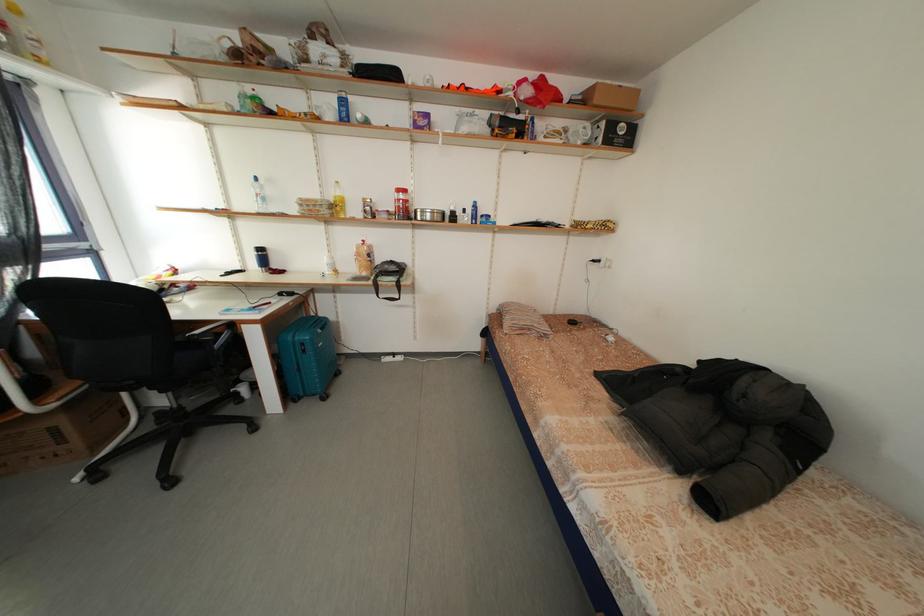
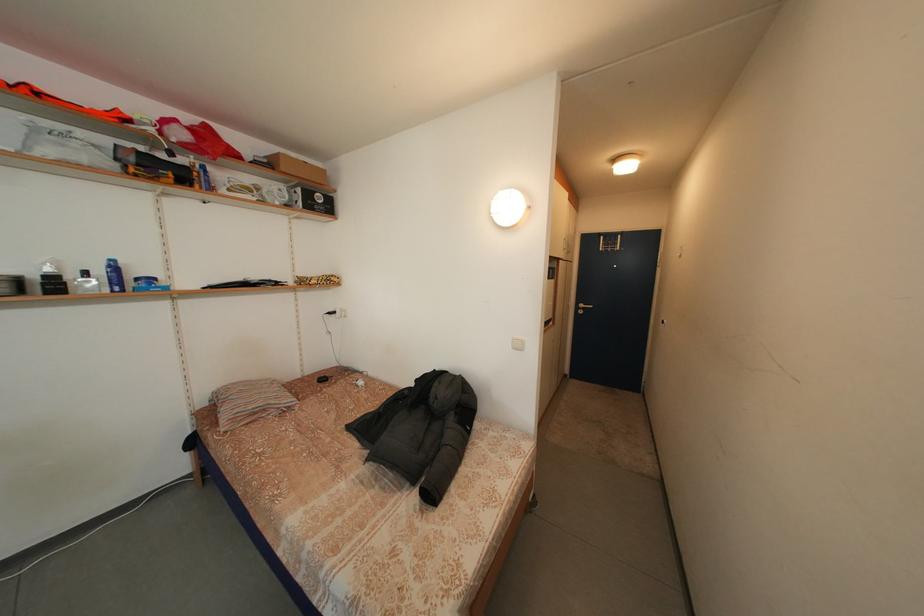
Locate, in the second image, the point that corresponds to point (515, 330) in the first image.

(233, 424)